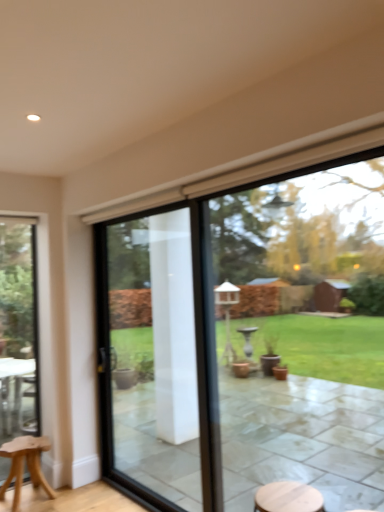
Question: Is clear glass door at left, arranged as the 2th window when viewed from the front, in front of or behind transparent glass window at center, the second window from the back, in the image?

Choices:
 (A) front
 (B) behind

Answer: (B)

Question: Does point tap(21, 391) appear closer or farther from the camera than point tap(306, 229)?

Choices:
 (A) farther
 (B) closer

Answer: (B)

Question: Which is farther from the clear glass door at left, the 1th window when ordered from left to right?

Choices:
 (A) light brown wooden stool at lower left
 (B) clear glass door at center
 (C) transparent glass window at center, the second window from the back

Answer: (C)

Question: Which object is the closest to the light brown wooden stool at lower left?

Choices:
 (A) clear glass door at left, acting as the first window starting from the back
 (B) clear glass door at center
 (C) transparent glass window at center, the first window when ordered from right to left

Answer: (A)